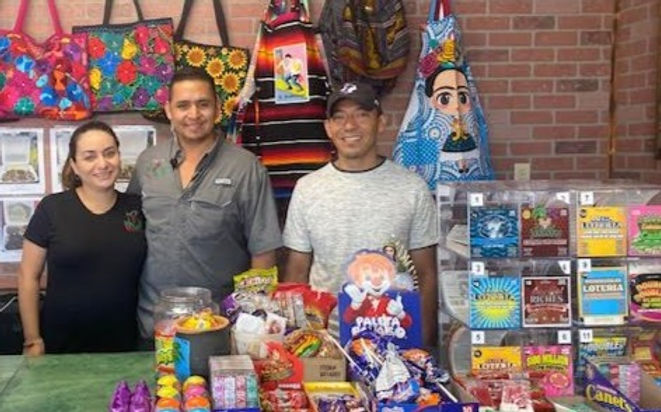
The height and width of the screenshot is (412, 661). I want to click on candy jar, so click(x=163, y=345).